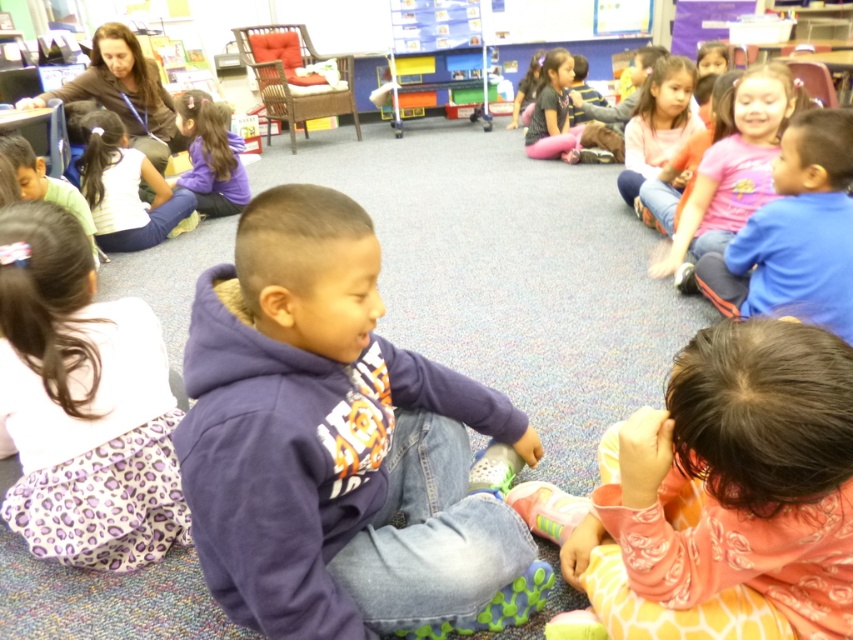
Is pink matte shirt at upper right in front of dark brown leather jacket at upper left?

Yes, it is.

Does pink matte shirt at upper right come behind dark brown leather jacket at upper left?

No, it is in front of dark brown leather jacket at upper left.

Describe the element at coordinates (793, 234) in the screenshot. I see `pink matte shirt at upper right` at that location.

The image size is (853, 640). I want to click on pink matte shirt at upper right, so click(793, 234).

Can you confirm if pink matte shirt at upper right is smaller than matte purple shirt at center?

No, pink matte shirt at upper right is not smaller than matte purple shirt at center.

Can you confirm if pink matte shirt at upper right is wider than matte purple shirt at center?

In fact, pink matte shirt at upper right might be narrower than matte purple shirt at center.

Describe the element at coordinates (793, 234) in the screenshot. I see `pink matte shirt at upper right` at that location.

The image size is (853, 640). What are the coordinates of `pink matte shirt at upper right` in the screenshot? It's located at (793, 234).

Is purple leopard print skirt at lower left bigger than dark brown leather jacket at upper left?

No.

Is point (109, 428) positioned behind point (131, 33)?

No, it is in front of (131, 33).

Locate an element on the screen. purple leopard print skirt at lower left is located at coordinates (82, 403).